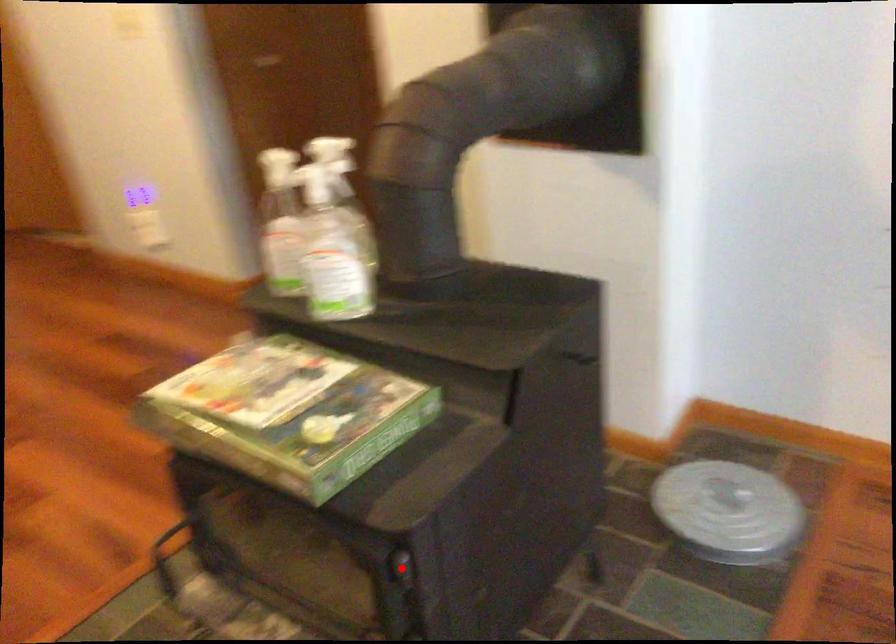
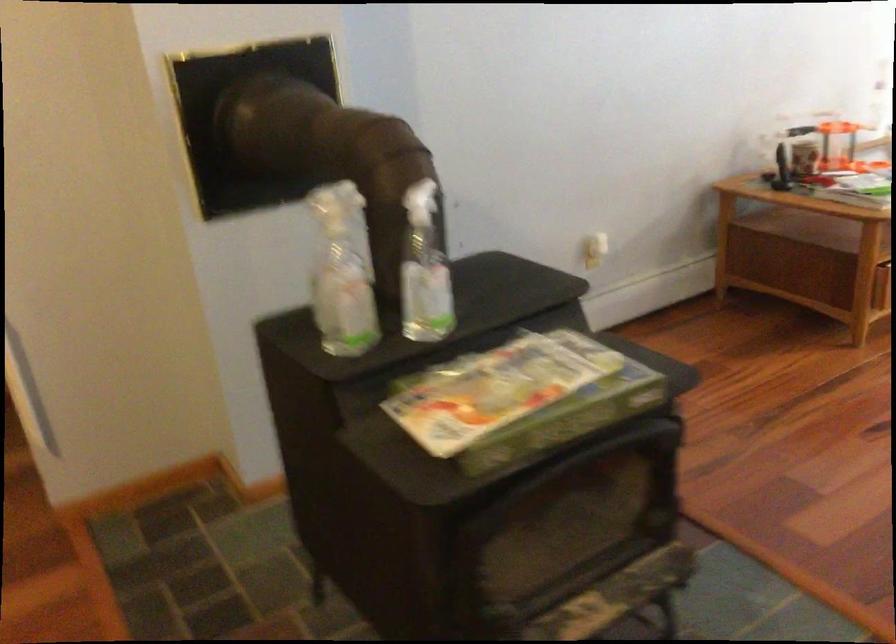
Question: I am providing you with two images of the same scene from different viewpoints. Image1 has a red point marked. In image2, the corresponding 3D location appears at what relative position? Reply with the corresponding letter.

Choices:
 (A) Closer
 (B) Farther

Answer: (B)